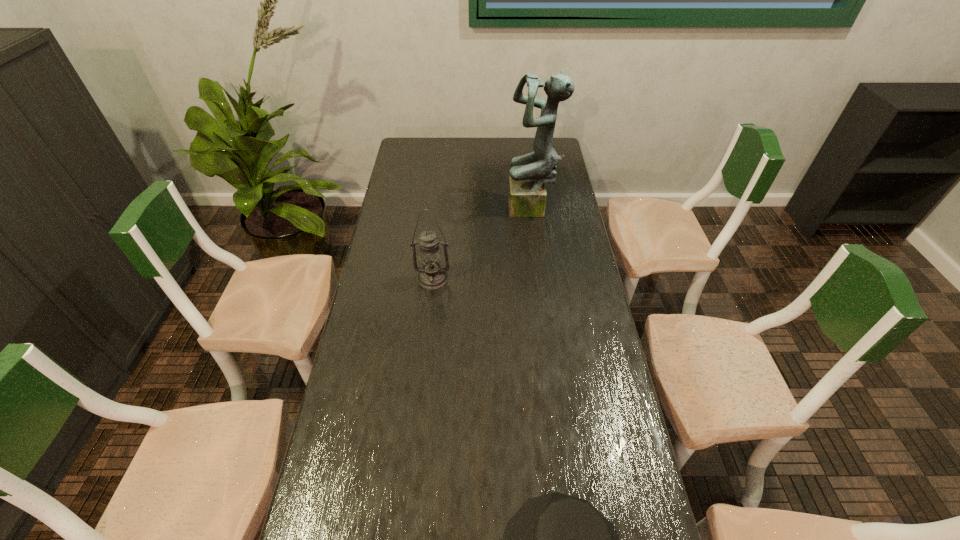
Where is `free space at the left edge`? free space at the left edge is located at coordinates (383, 264).

The image size is (960, 540). What are the coordinates of `vacant region at the right edge of the desktop` in the screenshot? It's located at (586, 258).

Identify the location of vacant space at the far left corner of the desktop. The width and height of the screenshot is (960, 540). (420, 137).

Where is `vacant space that's between the second shortest object and the sculpture`? This screenshot has width=960, height=540. vacant space that's between the second shortest object and the sculpture is located at coordinates (482, 244).

Identify the location of empty location between the farthest object and the second tallest object. This screenshot has height=540, width=960. (482, 244).

Locate an element on the screen. This screenshot has width=960, height=540. vacant point located between the tallest object and the second tallest object is located at coordinates (482, 244).

Locate an element on the screen. This screenshot has width=960, height=540. vacant area between the farthest object and the second tallest object is located at coordinates (482, 244).

Locate an element on the screen. Image resolution: width=960 pixels, height=540 pixels. free space between the sculpture and the oil lamp is located at coordinates [482, 244].

Locate an element on the screen. Image resolution: width=960 pixels, height=540 pixels. the second closest object to the second nearest object is located at coordinates (556, 539).

At what (x,y) coordinates should I click in order to perform the action: click on object that is the closest to the shortest object. Please return your answer as a coordinate pair (x, y). Image resolution: width=960 pixels, height=540 pixels. Looking at the image, I should click on (432, 275).